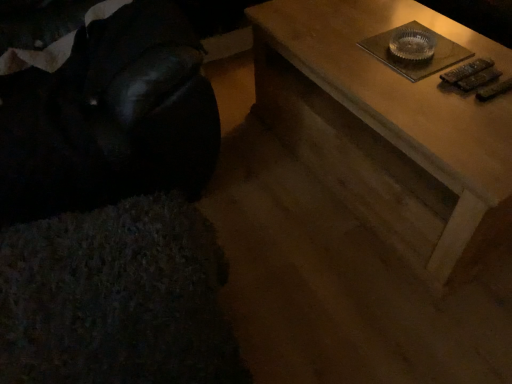
This screenshot has width=512, height=384. Find the location of `free space in front of wooden table at upper right`. free space in front of wooden table at upper right is located at coordinates (367, 297).